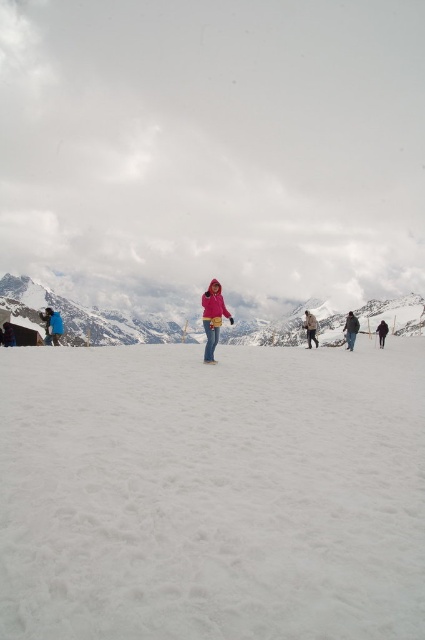
You are a photographer trying to capture the person in the bright pink jacket and dark blue jeans at center. To ensure the jeans are in focus, where should you aim the camera? Specify the coordinates provided in the description.

The dark blue jeans at center are located at coordinates point (351, 330), so aim the camera at that point to focus on the jeans.

You are standing in the snowy landscape and see the point marked at coordinates (351,330). What object is located at that point?

The point at coordinates (351,330) indicates dark blue jeans at center.